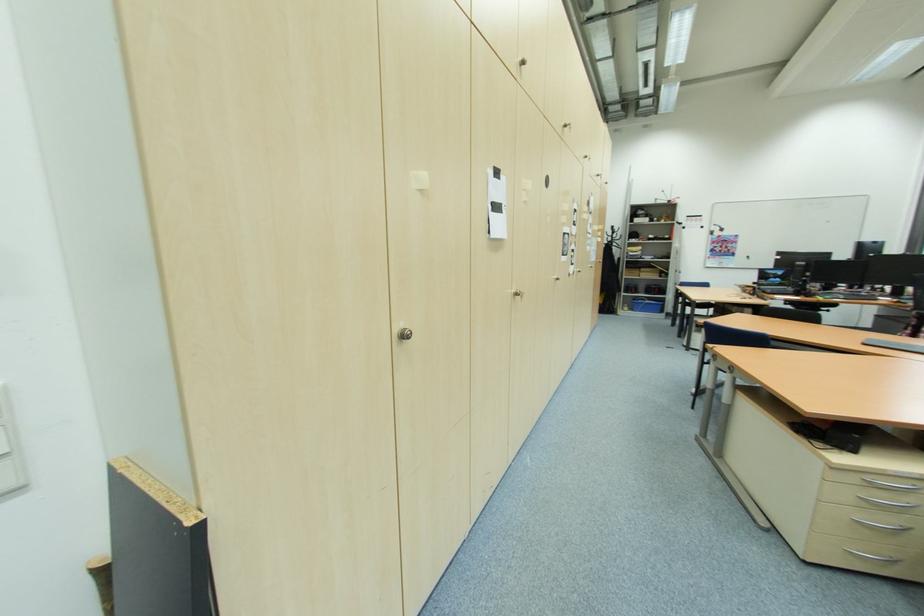
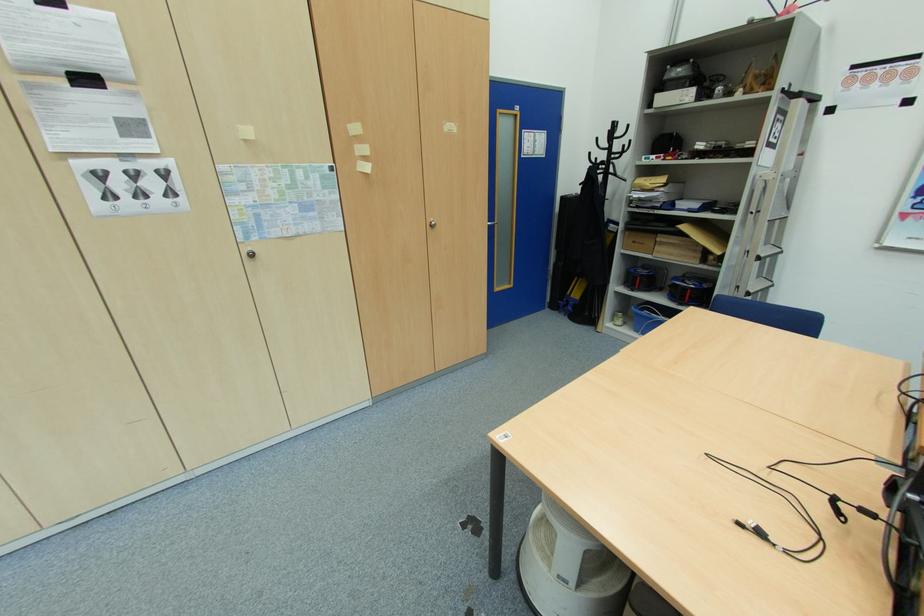
The point at (618, 245) is marked in the first image. Where is the corresponding point in the second image?

(614, 169)